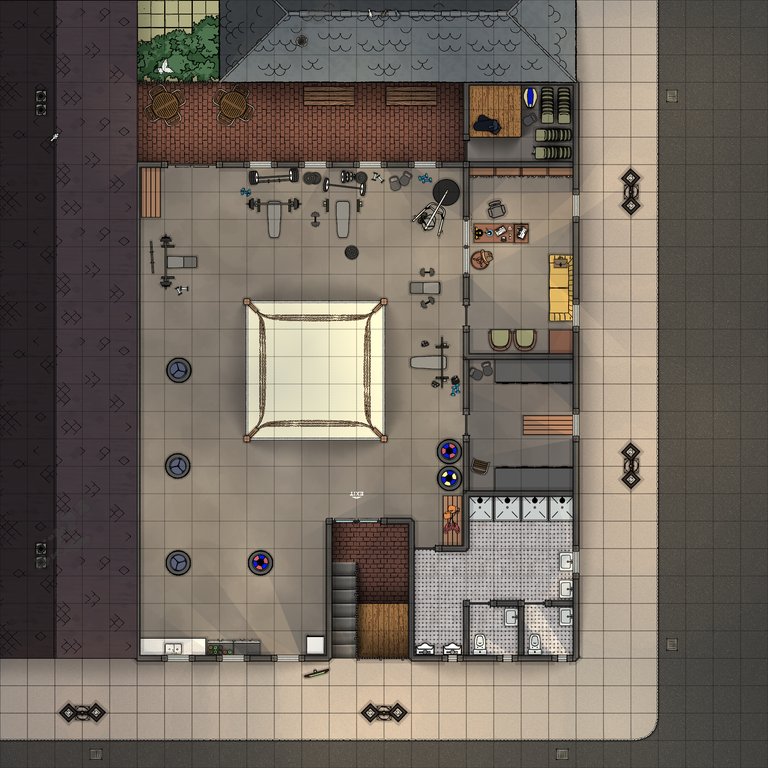
This screenshot has height=768, width=768. In order to click on sink in this screenshot , I will do `click(508, 611)`, `click(561, 614)`, `click(560, 584)`, `click(560, 561)`.